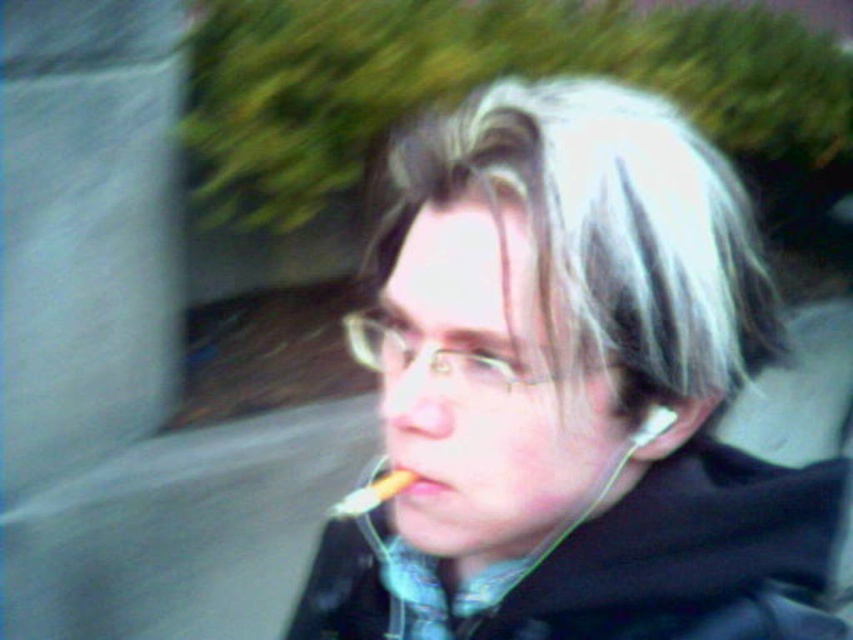
You are a photographer trying to capture a detailed shot of the black matte jacket at lower right and the smooth yellow toothbrush at lower center. Since the background is blurred, can you determine which object is positioned to the right of the other?

The black matte jacket at lower right is to the right of the smooth yellow toothbrush at lower center, so the jacket is positioned to the right of the toothbrush.

You are a photographer trying to capture a close shot of the matte black jacket at center while avoiding the yellowish matte cigarette at center in the frame. Given the distance between them, can you adjust your camera position to focus on the jacket without the cigarette appearing in the shot?

The distance between the matte black jacket at center and the yellowish matte cigarette at center is 1.72 meters. Since they are separated by this distance, adjusting the camera angle or position could allow focusing on the matte black jacket at center while excluding the yellowish matte cigarette at center from the frame.

You are a photographer trying to capture a detailed shot of the black matte jacket at lower right and the smooth yellow toothbrush at lower center. Since the background is blurred, you need to adjust the focus. Which object should you focus on first if you want to ensure both are in focus, considering their sizes?

The black matte jacket at lower right has a larger width than the smooth yellow toothbrush at lower center, so focusing on the larger object first would help ensure both are in focus.